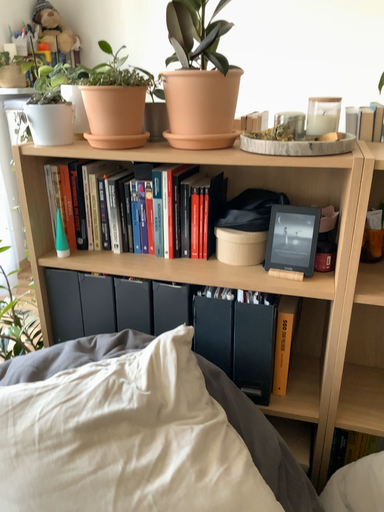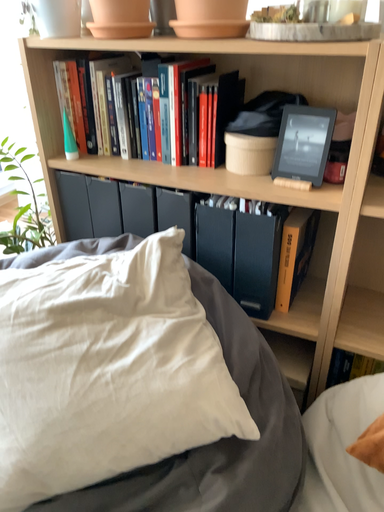
Question: Which way did the camera rotate in the video?

Choices:
 (A) rotated downward
 (B) rotated upward

Answer: (A)